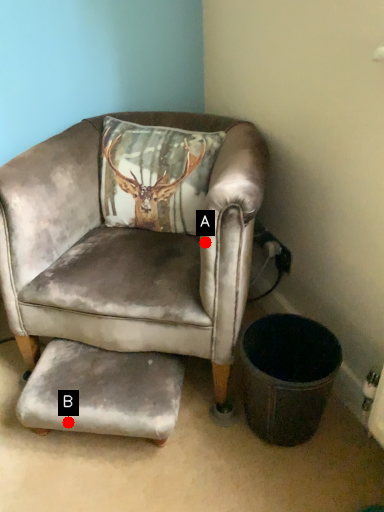
Question: Two points are circled on the image, labeled by A and B beside each circle. Which point is farther from the camera taking this photo?

Choices:
 (A) A is further
 (B) B is further

Answer: (B)